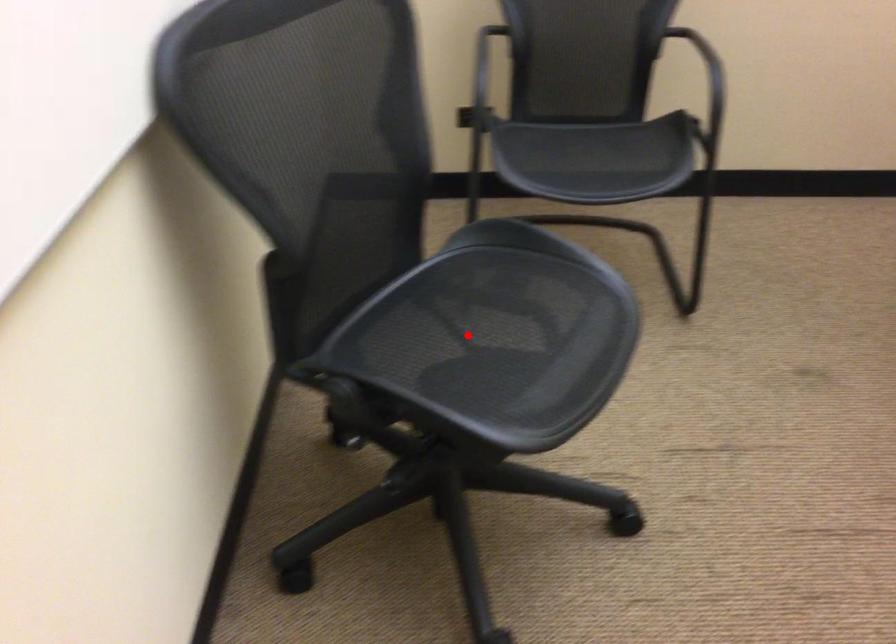
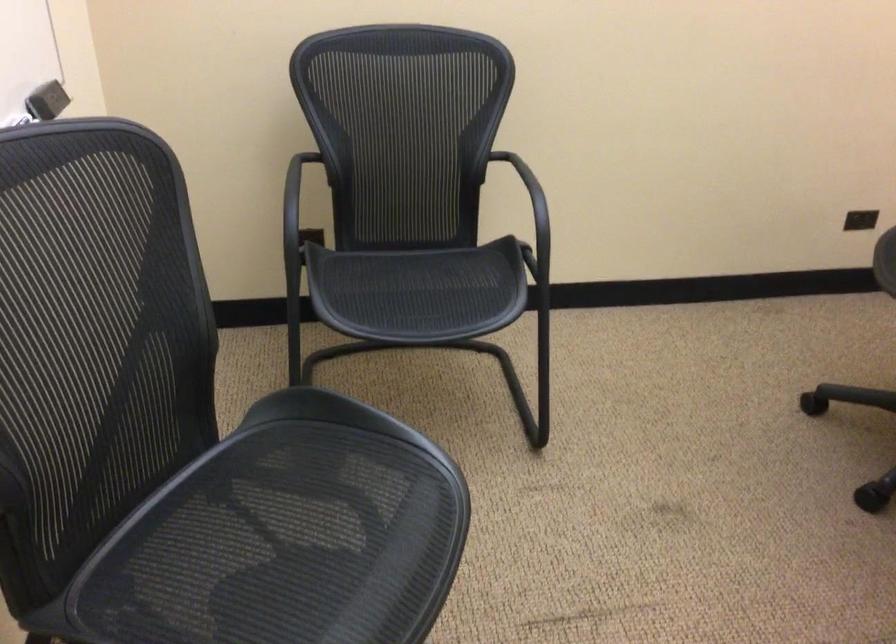
Question: I am providing you with two images of the same scene from different viewpoints. A red point is shown in image1. For the corresponding object point in image2, is it positioned nearer or farther from the camera?

Choices:
 (A) Nearer
 (B) Farther

Answer: (A)